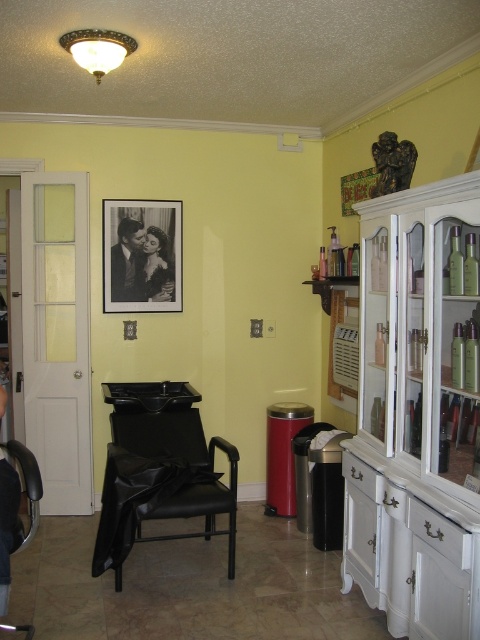
Question: Considering the real-world distances, which object is farthest from the white glossy cabinet at right?

Choices:
 (A) black leather armchair at center
 (B) black leather armchair at lower left

Answer: (B)

Question: From the image, what is the correct spatial relationship of white glossy cabinet at right in relation to black leather armchair at center?

Choices:
 (A) above
 (B) below

Answer: (A)

Question: Estimate the real-world distances between objects in this image. Which object is farther from the white glossy cabinet at right?

Choices:
 (A) black paper at upper center
 (B) black leather armchair at center
 (C) black leather armchair at lower left
 (D) metallic silver calendar at center

Answer: (A)

Question: Considering the real-world distances, which object is farthest from the metallic silver calendar at center?

Choices:
 (A) black leather armchair at lower left
 (B) black leather armchair at center

Answer: (A)

Question: Can you confirm if black paper at upper center is positioned to the left of black leather armchair at lower left?

Choices:
 (A) yes
 (B) no

Answer: (B)

Question: Does white glossy cabinet at right have a greater width compared to black paper at upper center?

Choices:
 (A) yes
 (B) no

Answer: (B)